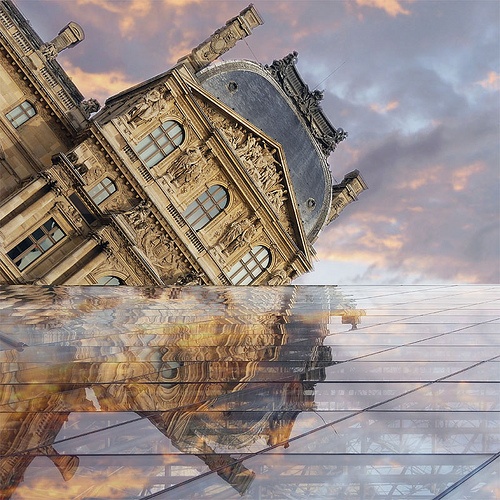
Find the location of `glass panels`. glass panels is located at coordinates (329, 481), (384, 431), (444, 395).